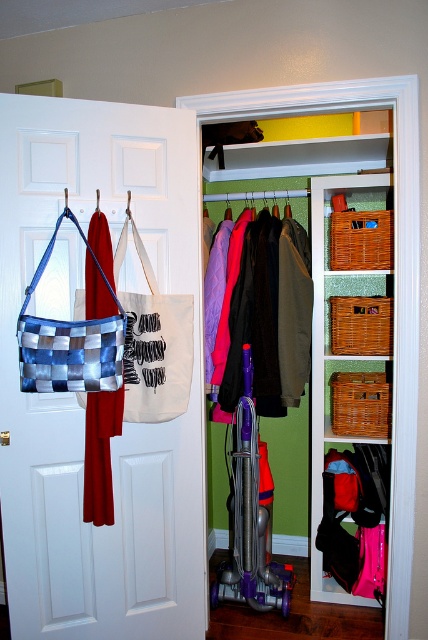
Question: Which of the following is the farthest from the observer?

Choices:
 (A) white matte door at left
 (B) matte purple jacket at center

Answer: (B)

Question: Can you confirm if purple plastic vacuum cleaner at center is smaller than dark green fabric pants at center?

Choices:
 (A) yes
 (B) no

Answer: (B)

Question: Which of the following is the farthest from the observer?

Choices:
 (A) white matte door at left
 (B) matte purple jacket at center

Answer: (B)

Question: Is purple plastic vacuum cleaner at center to the left of matte purple jacket at center from the viewer's perspective?

Choices:
 (A) no
 (B) yes

Answer: (B)

Question: Which object is the closest to the woven wicker baskets at upper center?

Choices:
 (A) blue woven bag at left
 (B) purple plastic vacuum cleaner at center

Answer: (B)

Question: Observing the image, what is the correct spatial positioning of matte wicker basket at center right in reference to red fabric bag at left?

Choices:
 (A) below
 (B) above

Answer: (B)